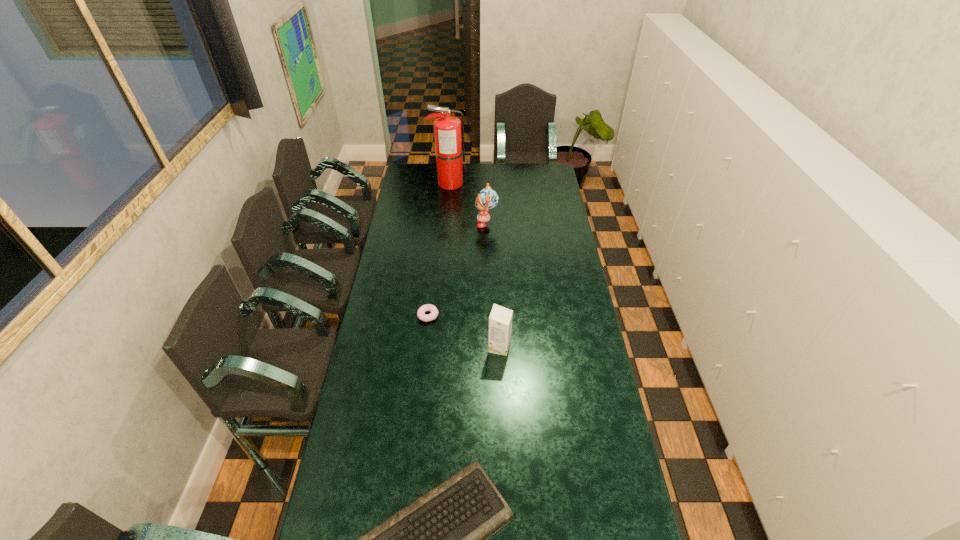
In order to click on vacant area that lies between the doll and the fourth farthest object in this screenshot , I will do `click(493, 286)`.

Identify the location of vacant space that is in between the farthest object and the doll. Image resolution: width=960 pixels, height=540 pixels. (468, 204).

This screenshot has height=540, width=960. In order to click on vacant area that lies between the fourth nearest object and the fourth farthest object in this screenshot , I will do `click(493, 286)`.

Find the location of a particular element. This screenshot has width=960, height=540. object that stands as the second closest to the computer keyboard is located at coordinates (421, 315).

Select which object appears as the second closest to the doll. Please provide its 2D coordinates. Your answer should be formatted as a tuple, i.e. [(x, y)], where the tuple contains the x and y coordinates of a point satisfying the conditions above.

[(421, 315)]

Identify the location of free point that satisfies the following two spatial constraints: 1. on the face of the carton; 2. on the left side of the doll. (489, 347).

This screenshot has height=540, width=960. I want to click on free location that satisfies the following two spatial constraints: 1. at the nozzle of the farthest object; 2. on the left side of the carton, so click(x=435, y=347).

Locate an element on the screen. free spot that satisfies the following two spatial constraints: 1. at the nozzle of the farthest object; 2. on the left side of the second nearest object is located at coordinates (435, 347).

Find the location of `vacant region that satisfies the following two spatial constraints: 1. at the nozzle of the carton; 2. on the left side of the farthest object`. vacant region that satisfies the following two spatial constraints: 1. at the nozzle of the carton; 2. on the left side of the farthest object is located at coordinates (435, 347).